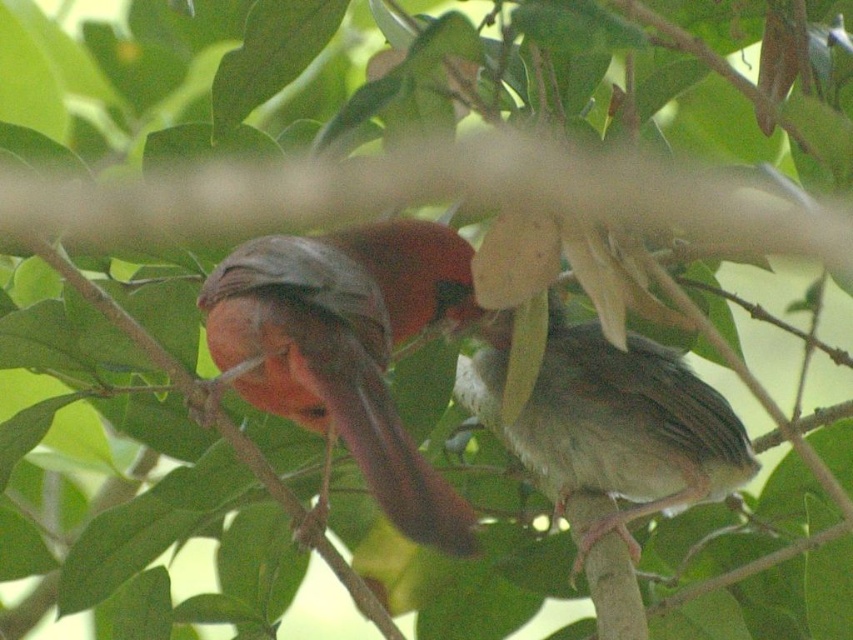
You are an ornithologist observing two birds on a branch. You notice a point marked at coordinates (x=346, y=348). Based on the scene description, which bird does this point most likely indicate?

The point at coordinates (x=346, y=348) most likely indicates the matte orange bird at center, as the description specifies that this point corresponds to that particular bird.

You are standing 5 feet away from the branch where the two birds are perched. There is a point at coordinates point [395,420]. Can you reach this point with a 4.5 feet long stick without moving closer to the branch?

The distance of point [395,420] from viewer is 3.95 feet. Since the stick is 4.5 feet long and you are 5 feet away, the stick is long enough to reach the point as 4.5 feet is greater than 3.95 feet.

You are observing two birds on a branch. There is a matte orange bird at center and another bird. Based on their positions, which bird is closer to the left edge of the branch?

The matte orange bird at center is closer to the left edge of the branch because it is located at point (346, 348), which places it more to the left compared to the other bird positioned slightly below and to the right.